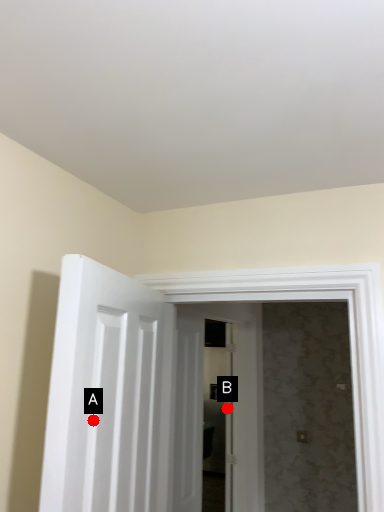
Question: Two points are circled on the image, labeled by A and B beside each circle. Among these points, which one is nearest to the camera?

Choices:
 (A) A is closer
 (B) B is closer

Answer: (A)